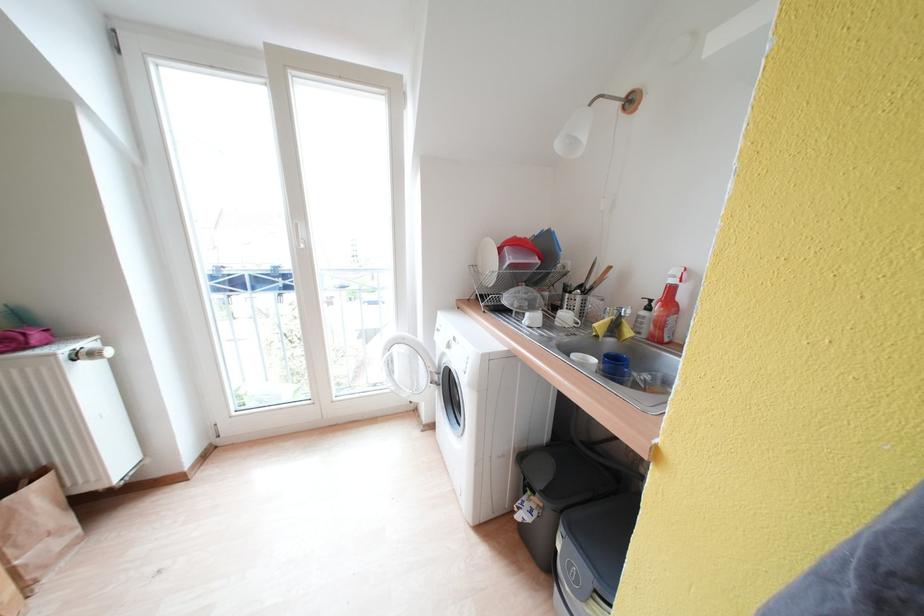
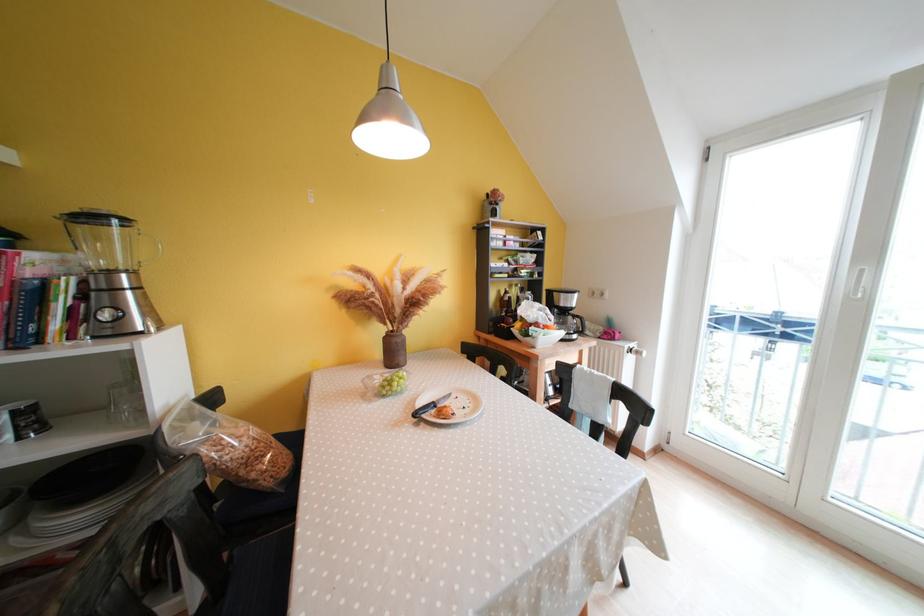
Question: The first image is from the beginning of the video and the second image is from the end. How did the camera likely rotate when shooting the video?

Choices:
 (A) Left
 (B) Right
 (C) Up
 (D) Down

Answer: (A)